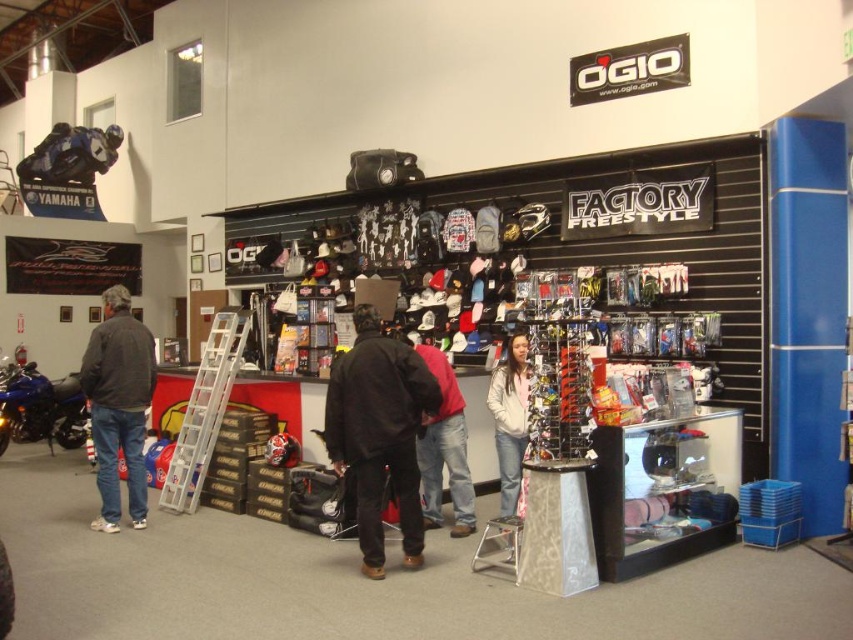
You are standing in the retail store and want to take a photo of the point at coordinates (422, 486). If your camera has a maximum focus range of 5 meters, will you need to move closer to capture it clearly?

The point at coordinates (422, 486) is 5.62 meters away from the camera. Since the camera can only focus up to 5 meters, you need to move closer to ensure the point is within the focus range.

You are a customer in the store and want to purchase the dark gray jacket at left and the blue metallic motorcycle at left. However, you have a limited budget. Which item should you choose if you want to buy the cheaper one?

The dark gray jacket at left has a smaller size compared to blue metallic motorcycle at left, so it is likely cheaper than the motorcycle. Therefore, you should choose the dark gray jacket at left if you want to buy the cheaper one.